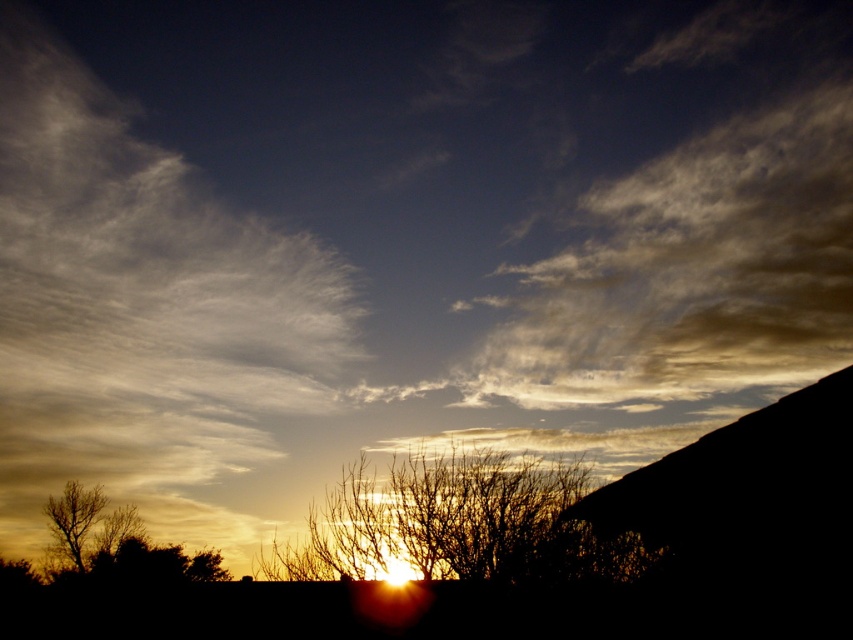
Question: Which point is farther to the camera?

Choices:
 (A) silhouette bare tree at center
 (B) brown matte tree at lower left

Answer: (B)

Question: Which object appears farthest from the camera in this image?

Choices:
 (A) silhouette bare tree at center
 (B) brown matte tree at lower left

Answer: (B)

Question: Does silhouette bare tree at center appear on the right side of brown matte tree at lower left?

Choices:
 (A) no
 (B) yes

Answer: (B)

Question: Is silhouette bare tree at center positioned in front of brown matte tree at lower left?

Choices:
 (A) yes
 (B) no

Answer: (A)

Question: Is silhouette bare tree at center positioned behind brown matte tree at lower left?

Choices:
 (A) yes
 (B) no

Answer: (B)

Question: Which of the following is the farthest from the observer?

Choices:
 (A) (90, 488)
 (B) (570, 576)

Answer: (A)